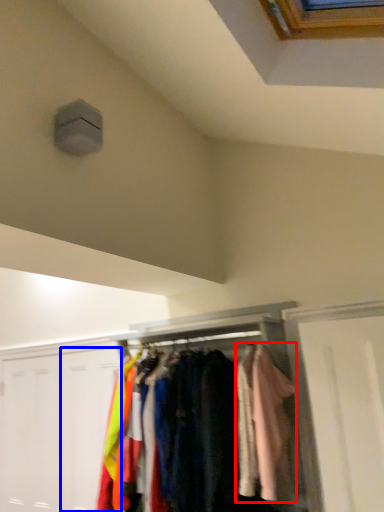
Question: Which of the following is the farthest to the observer, clothing (highlighted by a red box) or door (highlighted by a blue box)?

Choices:
 (A) clothing
 (B) door

Answer: (B)